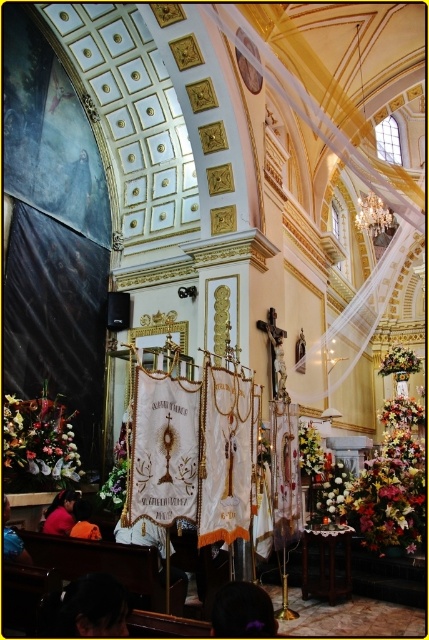
Question: Which point is farther to the camera?

Choices:
 (A) floral bouquet at center
 (B) floral bouquet at lower left
 (C) green leafy plant at center

Answer: (A)

Question: Is green leafy plant at center behind floral bouquet at center?

Choices:
 (A) no
 (B) yes

Answer: (A)

Question: Can you confirm if green leafy plant at center is thinner than floral bouquet at center?

Choices:
 (A) yes
 (B) no

Answer: (A)

Question: Which point is farther from the camera taking this photo?

Choices:
 (A) (57, 417)
 (B) (310, 428)
 (C) (398, 376)

Answer: (C)

Question: Does green leafy plant at center lie behind floral bouquet at center?

Choices:
 (A) yes
 (B) no

Answer: (B)

Question: Which is nearer to the floral bouquet at center?

Choices:
 (A) green leafy plant at center
 (B) floral bouquet at lower left

Answer: (A)